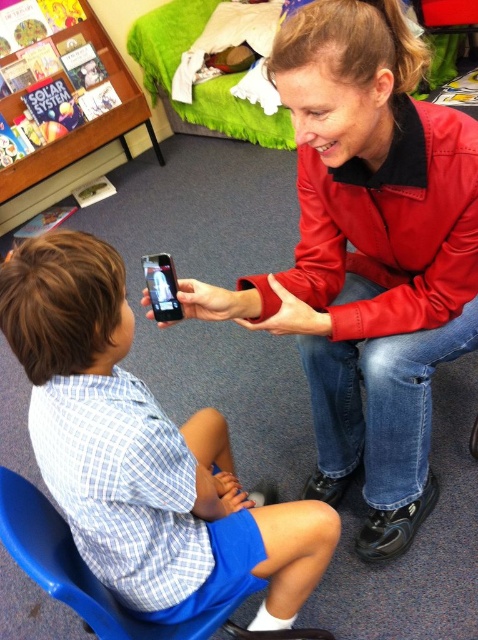
Question: Does blue plastic chair at lower left appear on the left side of matte black smartphone at center?

Choices:
 (A) no
 (B) yes

Answer: (B)

Question: Can you confirm if red leather jacket at upper center is positioned to the right of matte black smartphone at center?

Choices:
 (A) yes
 (B) no

Answer: (A)

Question: Which object is closer to the camera taking this photo?

Choices:
 (A) blue plastic chair at lower left
 (B) matte black smartphone at center
 (C) red leather jacket at upper center

Answer: (A)

Question: Among these points, which one is farthest from the camera?

Choices:
 (A) (186, 548)
 (B) (169, 268)

Answer: (A)

Question: Which of the following is the farthest from the observer?

Choices:
 (A) red leather jacket at upper center
 (B) wooden bookshelf at upper left
 (C) matte black smartphone at center
 (D) blue plastic chair at lower left

Answer: (B)

Question: Is red leather jacket at upper center in front of wooden bookshelf at upper left?

Choices:
 (A) yes
 (B) no

Answer: (A)